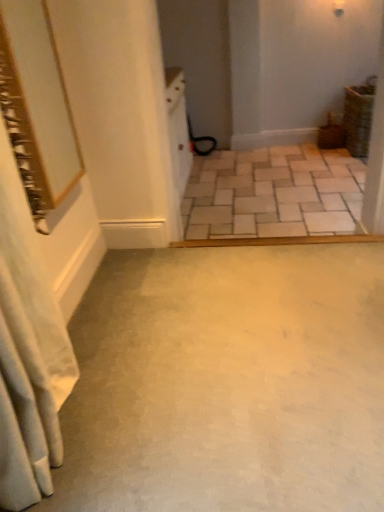
What are the coordinates of `vacant space behind white fabric shower curtain at left` in the screenshot? It's located at (116, 330).